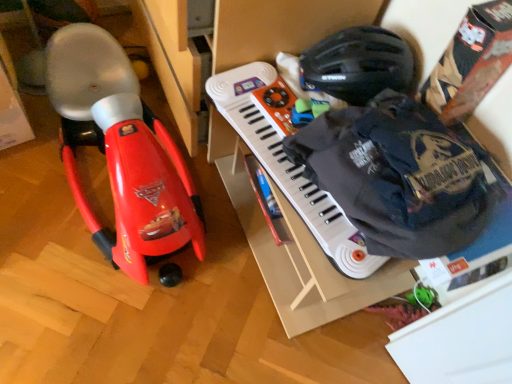
Question: Is black matte helmet at upper right shorter than matte red toy car at left?

Choices:
 (A) yes
 (B) no

Answer: (A)

Question: Is black matte helmet at upper right in front of matte red toy car at left?

Choices:
 (A) yes
 (B) no

Answer: (B)

Question: Would you say black matte helmet at upper right is outside matte red toy car at left?

Choices:
 (A) no
 (B) yes

Answer: (B)

Question: From a real-world perspective, is black matte helmet at upper right physically above matte red toy car at left?

Choices:
 (A) no
 (B) yes

Answer: (B)

Question: From the image's perspective, is black matte helmet at upper right under matte red toy car at left?

Choices:
 (A) yes
 (B) no

Answer: (B)

Question: Is point (132, 99) closer or farther from the camera than point (362, 26)?

Choices:
 (A) closer
 (B) farther

Answer: (A)

Question: Is matte red toy car at left in front of or behind black matte helmet at upper right in the image?

Choices:
 (A) behind
 (B) front

Answer: (B)

Question: Considering the positions of matte red toy car at left and black matte helmet at upper right in the image, is matte red toy car at left taller or shorter than black matte helmet at upper right?

Choices:
 (A) tall
 (B) short

Answer: (A)

Question: Visually, is matte red toy car at left positioned to the left or to the right of black matte helmet at upper right?

Choices:
 (A) right
 (B) left

Answer: (B)

Question: In terms of width, does white plastic musical keyboard at center look wider or thinner when compared to matte red toy car at left?

Choices:
 (A) wide
 (B) thin

Answer: (B)

Question: Choose the correct answer: Is white plastic musical keyboard at center inside matte red toy car at left or outside it?

Choices:
 (A) inside
 (B) outside

Answer: (B)

Question: From the image's perspective, is white plastic musical keyboard at center positioned above or below matte red toy car at left?

Choices:
 (A) above
 (B) below

Answer: (B)

Question: Considering the relative positions of white plastic musical keyboard at center and matte red toy car at left in the image provided, is white plastic musical keyboard at center to the left or to the right of matte red toy car at left?

Choices:
 (A) left
 (B) right

Answer: (B)

Question: In terms of width, does black matte helmet at upper right look wider or thinner when compared to matte red toy car at left?

Choices:
 (A) thin
 (B) wide

Answer: (A)

Question: Is black matte helmet at upper right in front of or behind matte red toy car at left in the image?

Choices:
 (A) front
 (B) behind

Answer: (B)